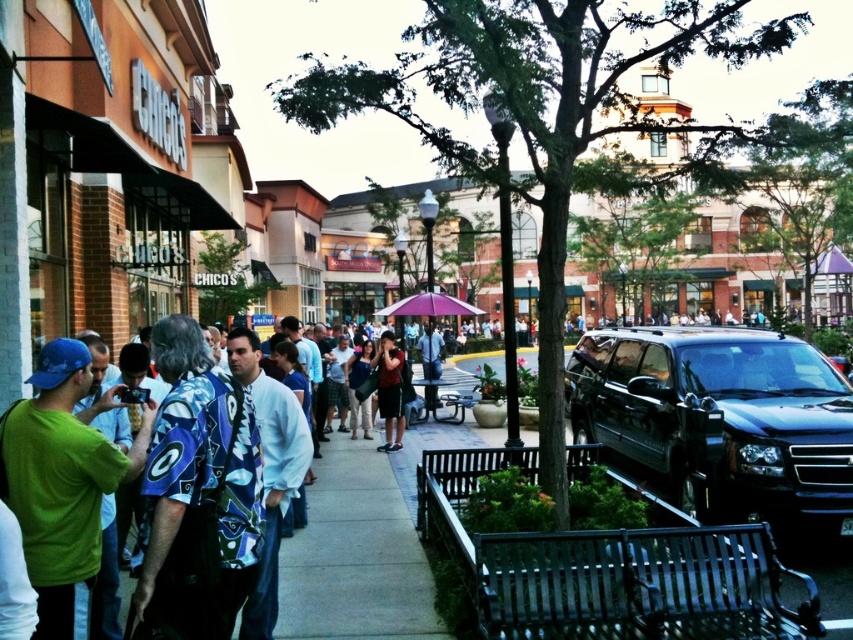
You are a delivery person trying to keep your package dry during a sudden rain shower. You see a shiny black suv at center and a purple fabric umbrella at center. Which object can you use to shelter from the rain?

The purple fabric umbrella at center can be used to shelter from the rain because it is designed to provide cover from rain, while the shiny black suv at center is a vehicle and not intended for this purpose.

You are a photographer standing at the edge of the sidewalk. You want to take a photo of the purple fabric umbrella at center without the dark blue shirt at center blocking it. What should you do?

Move to a position where the dark blue shirt at center is no longer between you and the purple fabric umbrella at center. Since the dark blue shirt at center is in front of the purple fabric umbrella at center, moving to the side or behind the shirt could allow you to capture the umbrella without obstruction.

From the picture: You are a photographer trying to capture a clear shot of both the dark blue shirt at center and the purple fabric umbrella at center. Since you want both subjects to be fully visible in your photo, which object should you focus on first to ensure it doesn t get cropped out?

→ You should focus on the purple fabric umbrella at center first because it is taller than the dark blue shirt at center, so it is more likely to be fully visible if positioned correctly.